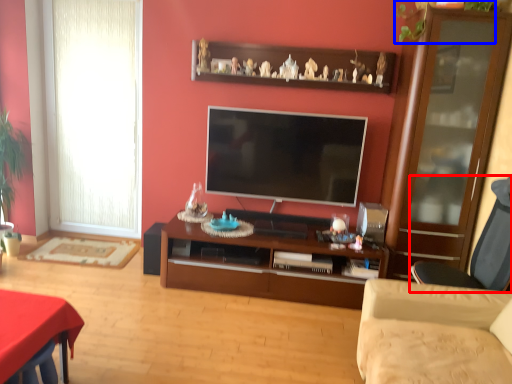
Question: Which point is closer to the camera, chair (highlighted by a red box) or plant (highlighted by a blue box)?

Choices:
 (A) chair
 (B) plant

Answer: (A)